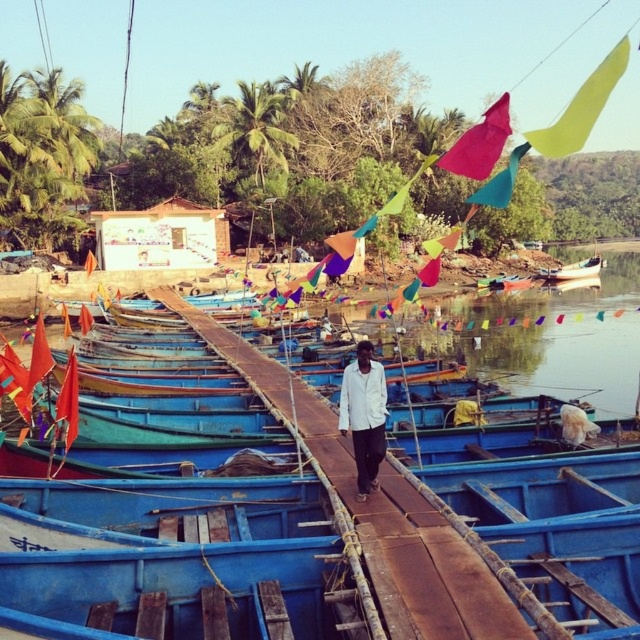
Does rusty wood dock at center have a greater width compared to white glossy boat at right?

Incorrect, rusty wood dock at center's width does not surpass white glossy boat at right's.

Is rusty wood dock at center further to the viewer compared to white glossy boat at right?

No, rusty wood dock at center is closer to the viewer.

Is point (212, 342) closer to camera compared to point (589, 266)?

Yes, it is in front of point (589, 266).

This screenshot has height=640, width=640. What are the coordinates of `rusty wood dock at center` in the screenshot? It's located at (387, 518).

Does rusty wood dock at center have a greater width compared to white matte shirt at center?

Yes, rusty wood dock at center is wider than white matte shirt at center.

Is rusty wood dock at center bigger than white matte shirt at center?

Yes, rusty wood dock at center is bigger than white matte shirt at center.

Measure the distance between point (317, 401) and camera.

Point (317, 401) is 22.22 meters away from camera.

I want to click on rusty wood dock at center, so click(387, 518).

Based on the photo, can you confirm if white matte shirt at center is smaller than white glossy boat at right?

Yes, white matte shirt at center is smaller than white glossy boat at right.

Consider the image. Is white matte shirt at center wider than white glossy boat at right?

No.

Is point (362, 468) more distant than point (588, 269)?

That is False.

I want to click on white matte shirt at center, so click(364, 413).